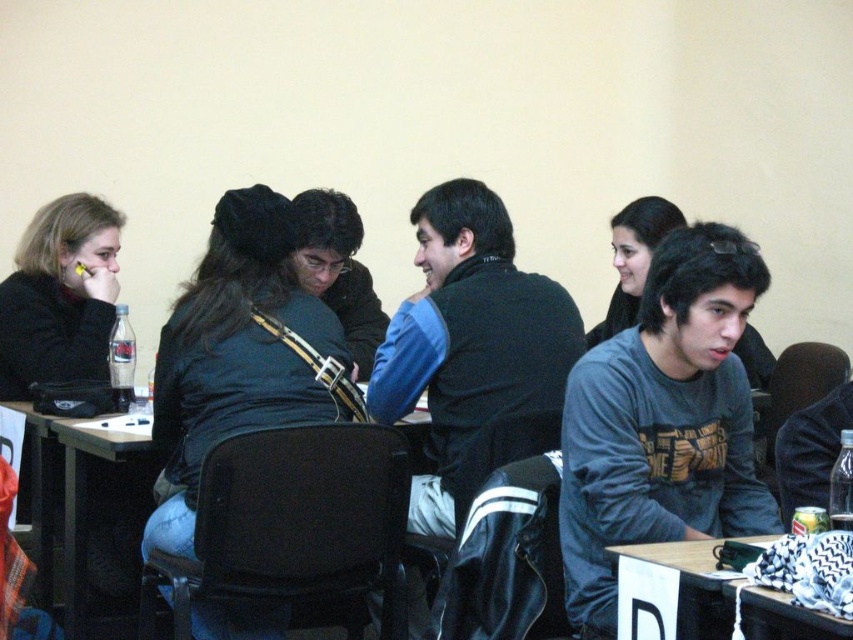
You are sitting at the wooden table at lower right and want to hand a document to the person wearing the dark green sweater at center. Can you directly hand it to them without getting up?

The wooden table at lower right is behind the dark green sweater at center, so you cannot directly hand the document to them without moving around the table or getting up.

From the picture: You are organizing a small event and need to place a 18cm tall decoration on either the dark green sweater at center or the wooden table at lower right. Based on their heights, which surface can safely accommodate the decoration without it being too unstable?

The dark green sweater at center has a greater height compared to the wooden table at lower right. Therefore, placing the 18cm tall decoration on the wooden table at lower right would be more stable as it has a lower height, reducing the risk of instability.

You are organizing a clothing donation drive and need to pack items into boxes. The gray cotton shirt at center and the dark green sweater at center are both to be packed. Which item should you choose if you want to maximize the number of items per box?

The gray cotton shirt at center is thinner than the dark green sweater at center, so you should choose the gray cotton shirt at center to maximize the number of items per box because it takes up less space.